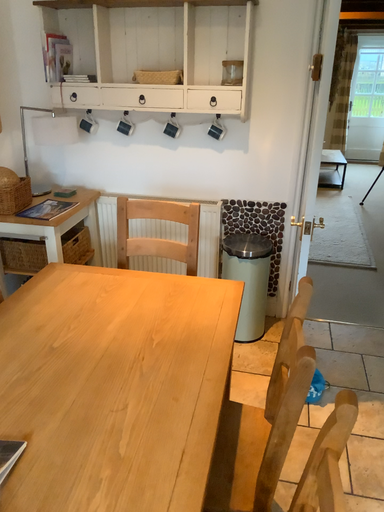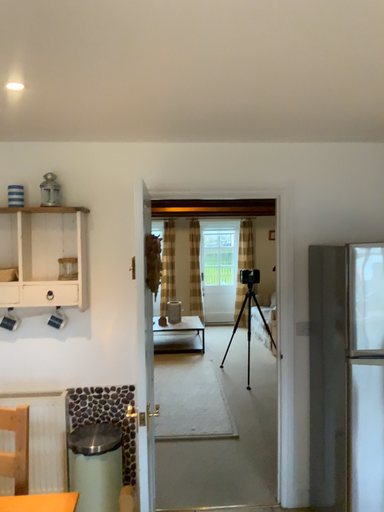
Question: How did the camera likely rotate when shooting the video?

Choices:
 (A) rotated upward
 (B) rotated downward

Answer: (A)